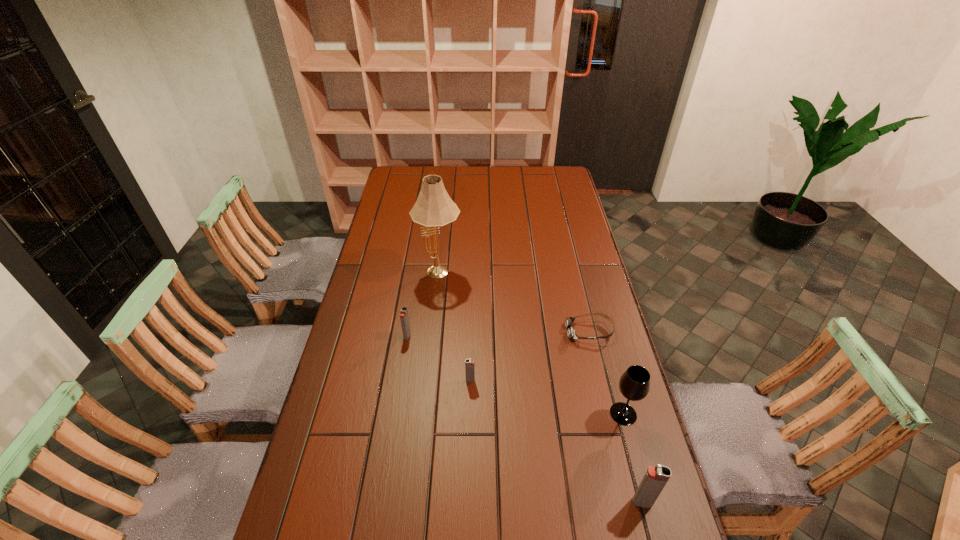
If equal spacing is the goal by inserting an additional igniter among them, please point out a vacant space for this new igniter. Please provide its 2D coordinates. Your answer should be formatted as a tuple, i.e. [(x, y)], where the tuple contains the x and y coordinates of a point satisfying the conditions above.

[(547, 435)]